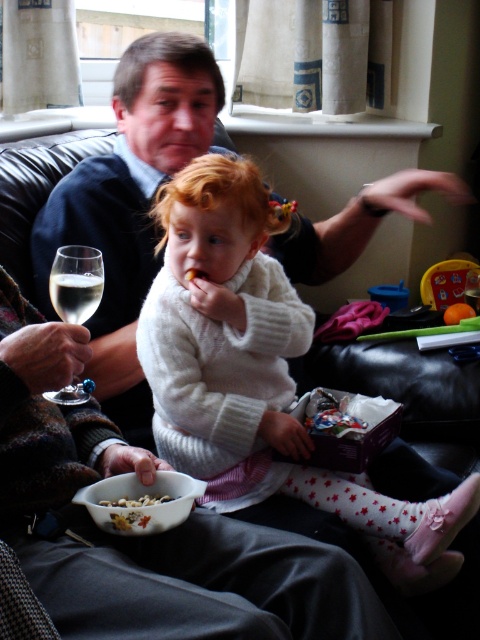
Question: Among these objects, which one is farthest from the camera?

Choices:
 (A) smooth white bowl at lower left
 (B) dark blue sweater at center
 (C) white knitted sweater at center
 (D) clear glass wine glass at left

Answer: (B)

Question: Which object appears closest to the camera in this image?

Choices:
 (A) clear glass wine glass at left
 (B) dark blue sweater at center
 (C) white knitted sweater at center

Answer: (A)

Question: Among these objects, which one is farthest from the camera?

Choices:
 (A) clear glass wine at upper left
 (B) white knitted sweater at center
 (C) crumbly brown cereal at lower left
 (D) clear glass wine glass at left

Answer: (B)

Question: Does white knitted sweater at center appear over dark blue sweater at center?

Choices:
 (A) yes
 (B) no

Answer: (B)

Question: In this image, where is dark blue sweater at center located relative to smooth white bowl at lower left?

Choices:
 (A) right
 (B) left

Answer: (B)

Question: Does clear glass wine glass at left have a smaller size compared to clear glass wine at upper left?

Choices:
 (A) no
 (B) yes

Answer: (A)